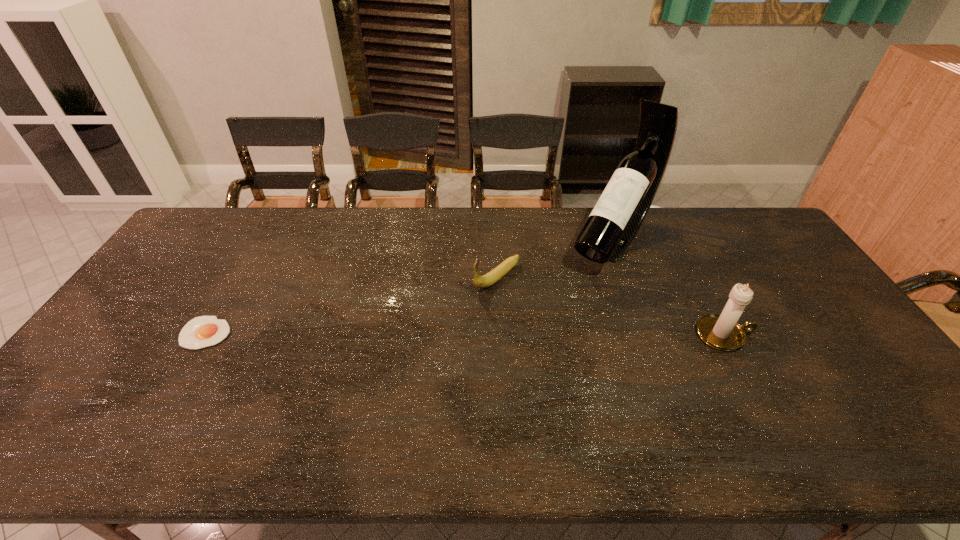
This screenshot has width=960, height=540. What are the coordinates of `vacant point located between the tallest object and the second shortest object` in the screenshot? It's located at (555, 259).

At what (x,y) coordinates should I click in order to perform the action: click on unoccupied area between the second tallest object and the leftmost object. Please return your answer as a coordinate pair (x, y). The width and height of the screenshot is (960, 540). Looking at the image, I should click on coord(465,334).

At what (x,y) coordinates should I click in order to perform the action: click on unoccupied area between the second shortest object and the candle holder. Please return your answer as a coordinate pair (x, y). This screenshot has width=960, height=540. Looking at the image, I should click on (611, 306).

Find the location of a particular element. This screenshot has height=540, width=960. free point between the candle holder and the shortest object is located at coordinates (465, 334).

Where is `free space that is in between the egg yolk and the candle holder`? This screenshot has height=540, width=960. free space that is in between the egg yolk and the candle holder is located at coordinates (465, 334).

I want to click on vacant space that is in between the candle holder and the wine bottle, so pos(668,287).

Find the location of `free space between the second shortest object and the wine bottle`. free space between the second shortest object and the wine bottle is located at coordinates (555, 259).

Image resolution: width=960 pixels, height=540 pixels. What are the coordinates of `free spot between the wine bottle and the third object from right to left` in the screenshot? It's located at (555, 259).

Identify the location of vacant space that is in between the egg yolk and the candle holder. (465, 334).

The width and height of the screenshot is (960, 540). What are the coordinates of `empty location between the tallest object and the candle holder` in the screenshot? It's located at (668, 287).